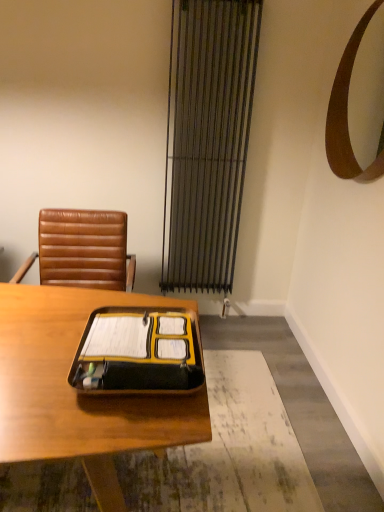
Question: In terms of size, does wooden desk at center appear bigger or smaller than metallic silver curtain at center?

Choices:
 (A) small
 (B) big

Answer: (B)

Question: From a real-world perspective, is wooden desk at center physically located above or below metallic silver curtain at center?

Choices:
 (A) above
 (B) below

Answer: (B)

Question: Considering the real-world distances, which object is closest to the wooden desk at center?

Choices:
 (A) brown wooden mirror at upper right
 (B) metallic silver curtain at center
 (C) brown leather chair at upper left
 (D) yellow matte folder at center

Answer: (D)

Question: Which is farther from the metallic silver curtain at center?

Choices:
 (A) wooden desk at center
 (B) brown wooden mirror at upper right
 (C) yellow matte folder at center
 (D) brown leather chair at upper left

Answer: (C)